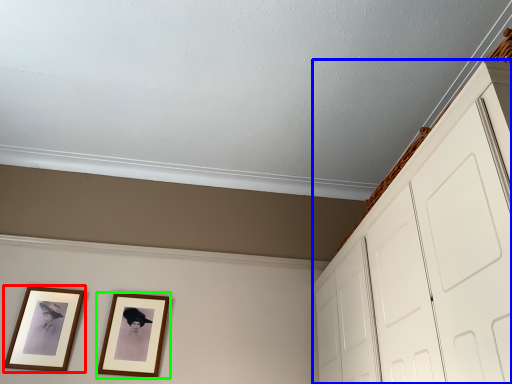
Question: Estimate the real-world distances between objects in this image. Which object is closer to picture frame (highlighted by a red box), dresser (highlighted by a blue box) or picture frame (highlighted by a green box)?

Choices:
 (A) dresser
 (B) picture frame

Answer: (B)